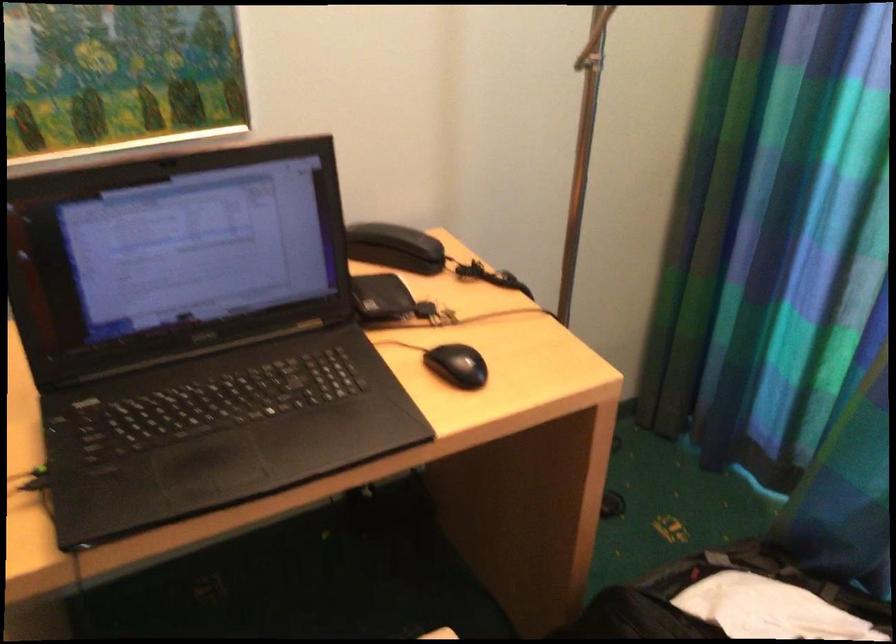
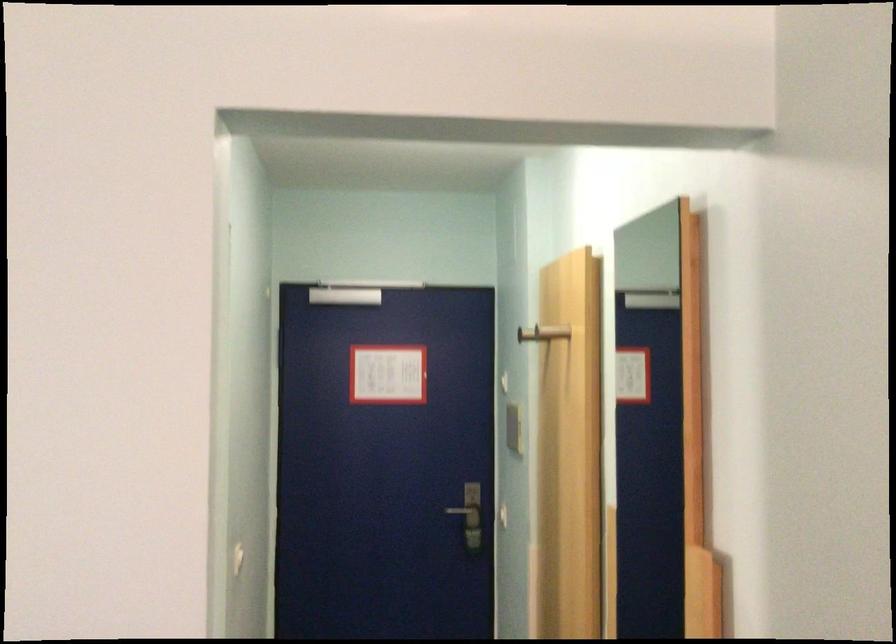
Question: The camera is either moving clockwise (left) or counter-clockwise (right) around the object. The first image is from the beginning of the video and the second image is from the end. Is the camera moving left or right when shooting the video?

Choices:
 (A) Left
 (B) Right

Answer: (B)